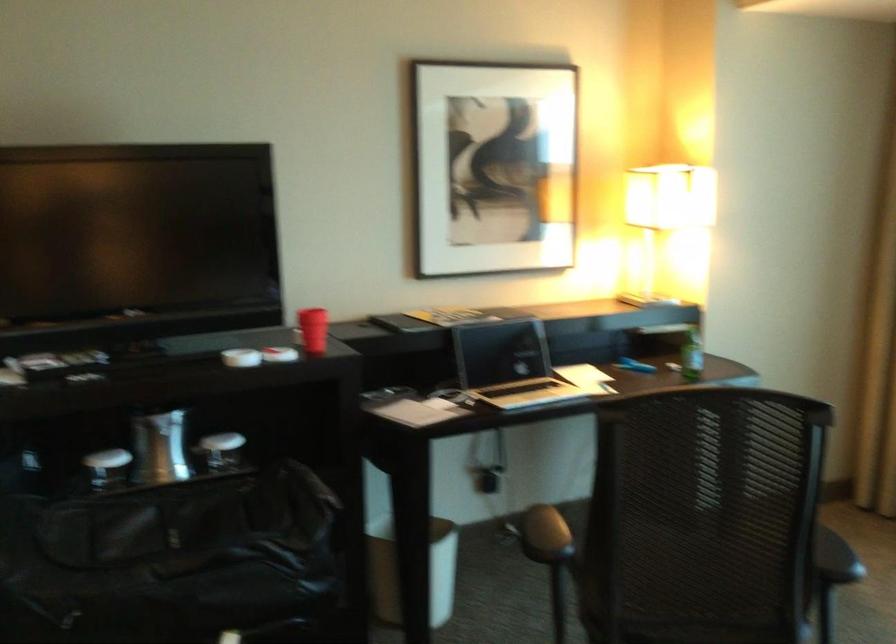
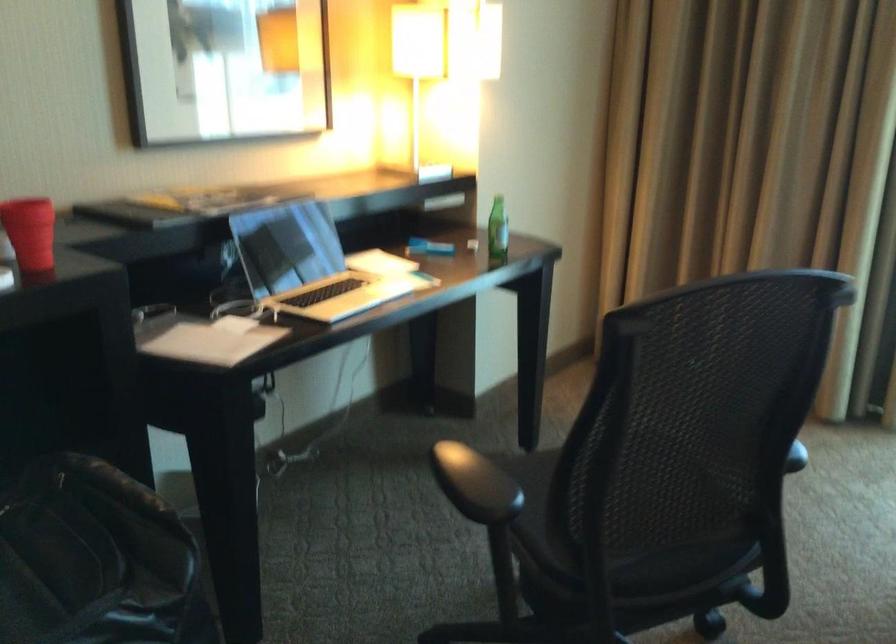
Find the pixel in the second image that matches point (306, 330) in the first image.

(30, 232)